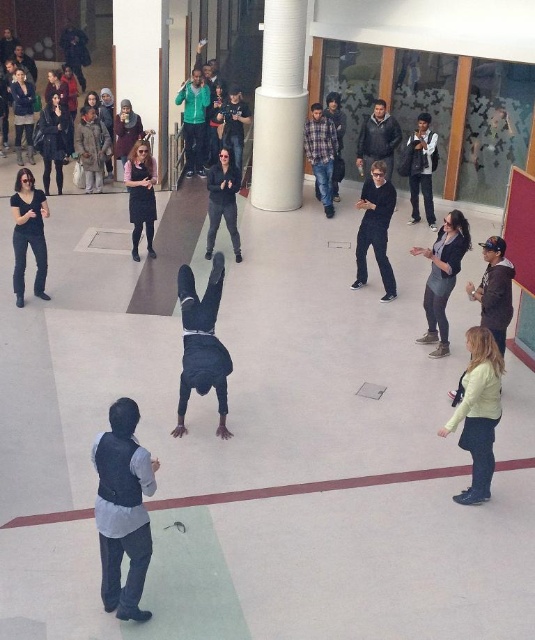
Question: Does black matte person at center appear under light brown leather jacket at center?

Choices:
 (A) no
 (B) yes

Answer: (B)

Question: Is dark gray hoodie at center wider than dark gray fabric jacket at center?

Choices:
 (A) yes
 (B) no

Answer: (A)

Question: Which of the following is the farthest from the observer?

Choices:
 (A) (189, 138)
 (B) (132, 164)

Answer: (A)

Question: Based on their relative distances, which object is farther from the light brown leather jacket at center?

Choices:
 (A) light brown leather jacket at lower right
 (B) plaid flannel shirt at center

Answer: (A)

Question: Is dark gray hoodie at center to the left of matte black pants at center from the viewer's perspective?

Choices:
 (A) yes
 (B) no

Answer: (B)

Question: Which point is farther to the camera?

Choices:
 (A) (330, 131)
 (B) (34, 243)
 (C) (214, 202)
 (D) (332, 92)

Answer: (D)